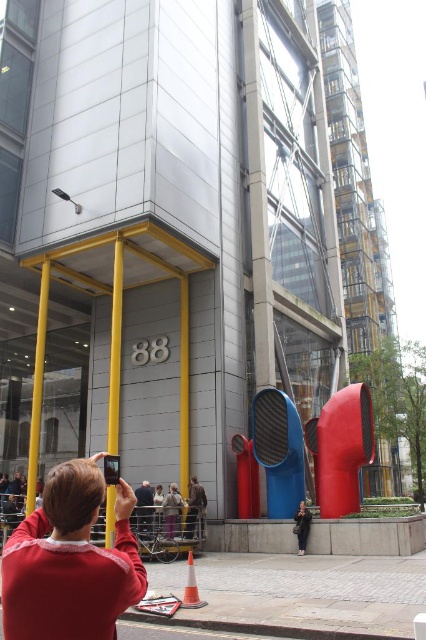
You are standing at the entrance of the modern building with the number 88 and want to place an orange plastic traffic cone at lower center. According to the image, where exactly should you position it?

The orange plastic traffic cone at lower center should be positioned at point coordinates (190, 586) as specified in the description.

You are a delivery person who needs to place a package on the ground near the matte brown jacket at center. However, there is an orange plastic traffic cone at lower center in the way. Can you move the jacket to the right side of the cone to make space?

The matte brown jacket at center is below the orange plastic traffic cone at lower center. Moving the jacket to the right side of the cone would require checking if there is enough space, but since the jacket is currently positioned below the cone, shifting it sideways might be possible depending on the surrounding area not mentioned in the scene description.